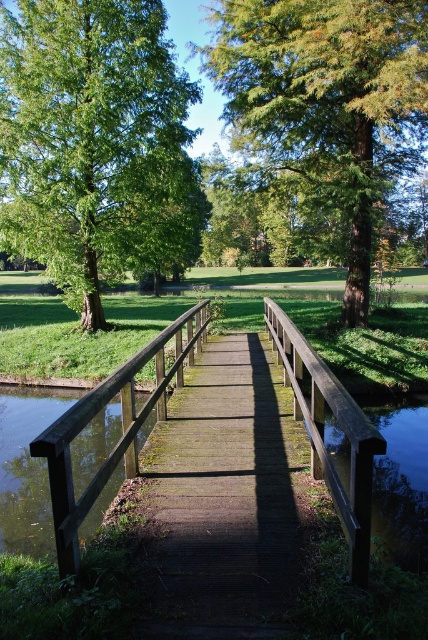
Is green matte tree at upper left to the right of mossy wooden bridge at center from the viewer's perspective?

Incorrect, green matte tree at upper left is not on the right side of mossy wooden bridge at center.

Is point (92, 38) behind point (234, 333)?

That is False.

Does point (100, 104) lie in front of point (219, 388)?

That is False.

What are the coordinates of `green matte tree at upper left` in the screenshot? It's located at point(86,129).

Can you confirm if green leafy tree at center is positioned to the right of mossy wooden bridge at center?

Indeed, green leafy tree at center is positioned on the right side of mossy wooden bridge at center.

Is green leafy tree at center bigger than mossy wooden bridge at center?

Indeed, green leafy tree at center has a larger size compared to mossy wooden bridge at center.

Does point (270, 134) come farther from viewer compared to point (262, 536)?

That is True.

The height and width of the screenshot is (640, 428). Find the location of `green leafy tree at center`. green leafy tree at center is located at coordinates (326, 104).

Can you confirm if mossy wooden bridge at center is positioned to the left of wooden bridge at center?

Correct, you'll find mossy wooden bridge at center to the left of wooden bridge at center.

Which of these two, mossy wooden bridge at center or wooden bridge at center, stands taller?

wooden bridge at center

Is point (193, 570) in front of point (312, 458)?

Yes.

Locate an element on the screen. mossy wooden bridge at center is located at coordinates (223, 497).